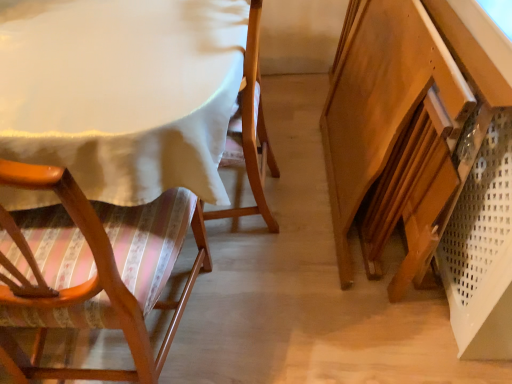
Question: Considering the relative sizes of white fabric table at upper left and wooden chair with striped cushion at left in the image provided, is white fabric table at upper left shorter than wooden chair with striped cushion at left?

Choices:
 (A) yes
 (B) no

Answer: (A)

Question: Is white fabric table at upper left at the left side of wooden chair with striped cushion at left?

Choices:
 (A) yes
 (B) no

Answer: (A)

Question: Considering the relative sizes of white fabric table at upper left and wooden chair with striped cushion at left in the image provided, is white fabric table at upper left taller than wooden chair with striped cushion at left?

Choices:
 (A) no
 (B) yes

Answer: (A)

Question: Is the depth of white fabric table at upper left less than that of wooden chair with striped cushion at left?

Choices:
 (A) no
 (B) yes

Answer: (A)

Question: Is white fabric table at upper left bigger than wooden chair with striped cushion at left?

Choices:
 (A) yes
 (B) no

Answer: (A)

Question: From the image's perspective, is white fabric table at upper left beneath wooden chair with striped cushion at left?

Choices:
 (A) no
 (B) yes

Answer: (A)

Question: Is wooden chair with striped cushion at left taller than white fabric table at upper left?

Choices:
 (A) no
 (B) yes

Answer: (B)

Question: Is wooden chair with striped cushion at left with white fabric table at upper left?

Choices:
 (A) yes
 (B) no

Answer: (B)

Question: Can you confirm if wooden chair with striped cushion at left is wider than white fabric table at upper left?

Choices:
 (A) no
 (B) yes

Answer: (A)

Question: From the image's perspective, does wooden chair with striped cushion at left appear higher than white fabric table at upper left?

Choices:
 (A) yes
 (B) no

Answer: (B)

Question: Can you confirm if wooden chair with striped cushion at left is bigger than white fabric table at upper left?

Choices:
 (A) yes
 (B) no

Answer: (B)

Question: Considering the relative positions of wooden chair with striped cushion at left and white fabric table at upper left in the image provided, is wooden chair with striped cushion at left to the right of white fabric table at upper left from the viewer's perspective?

Choices:
 (A) no
 (B) yes

Answer: (B)

Question: Could white fabric table at upper left be considered to be inside wooden vanity at lower right?

Choices:
 (A) yes
 (B) no

Answer: (B)